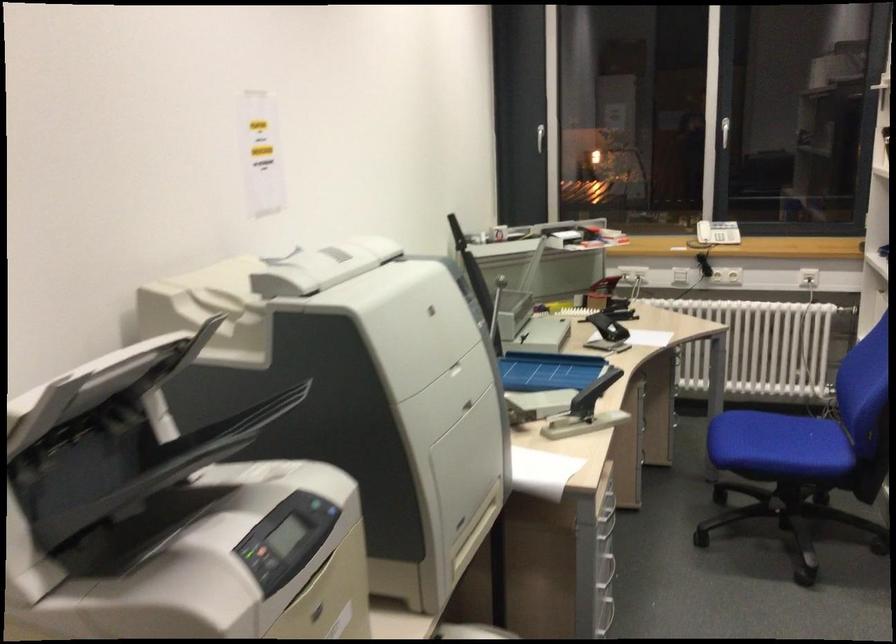
What do you see at coordinates (101, 401) in the screenshot?
I see `the copier lid` at bounding box center [101, 401].